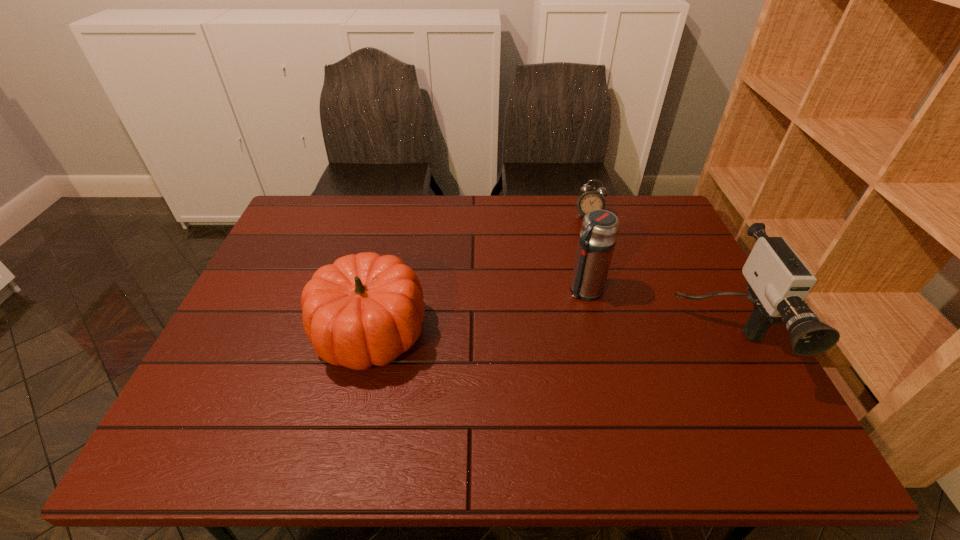
Locate an element on the screen. The width and height of the screenshot is (960, 540). vacant space on the desktop that is between the third tallest object and the camcorder and is positioned on the face of the shortest object is located at coordinates (561, 334).

This screenshot has width=960, height=540. In order to click on vacant space on the desktop that is between the leftmost object and the rightmost object and is positioned with a handle on the side of the thermos bottle in this screenshot , I will do `click(528, 333)`.